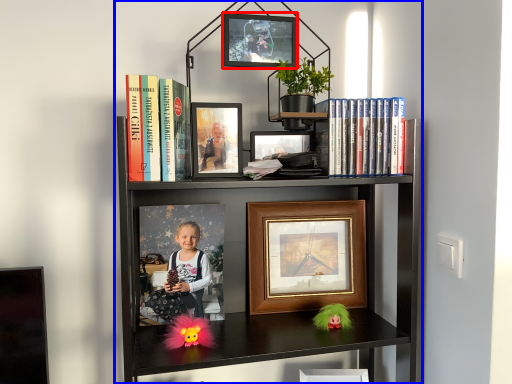
Question: Which point is further to the camera, picture frame (highlighted by a red box) or bookcase (highlighted by a blue box)?

Choices:
 (A) picture frame
 (B) bookcase

Answer: (A)